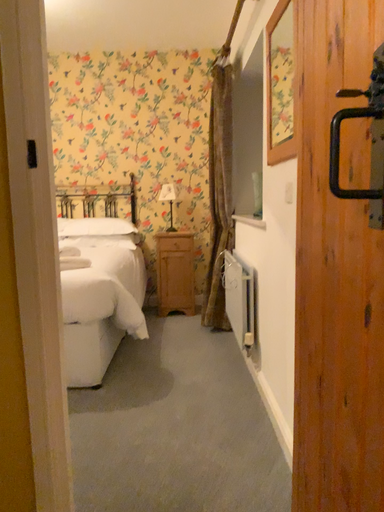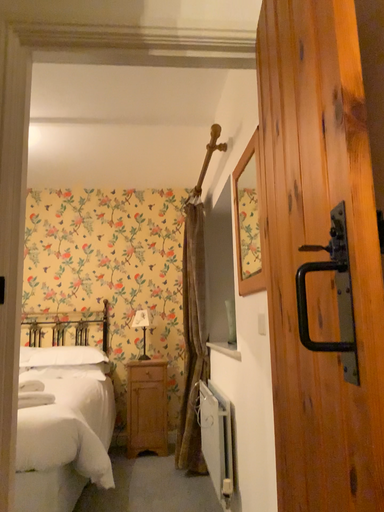
Question: Which way did the camera rotate in the video?

Choices:
 (A) rotated upward
 (B) rotated downward

Answer: (A)